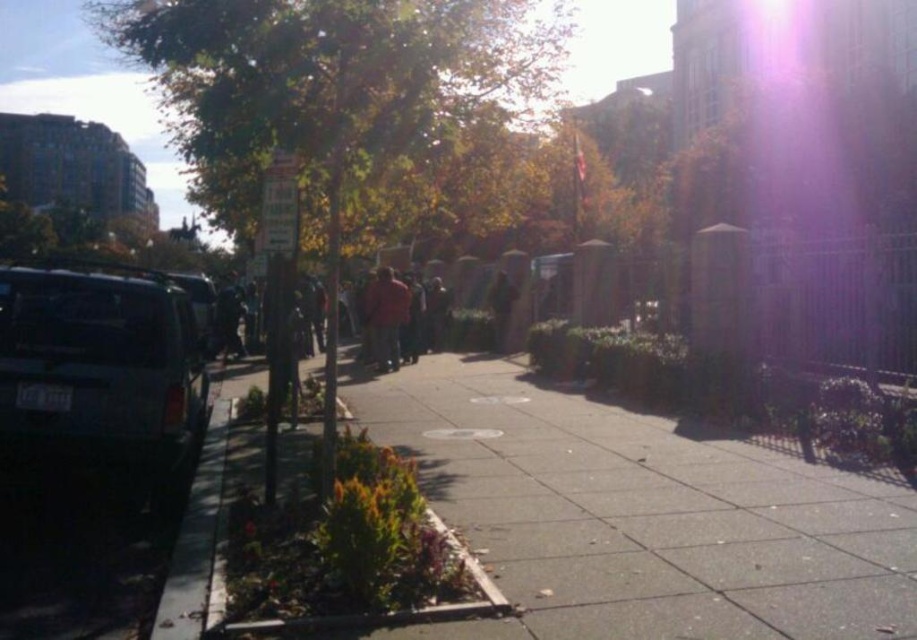
Which is behind, point (534, 12) or point (186, 285)?

Positioned behind is point (534, 12).

Find the location of a particular element. This screenshot has width=917, height=640. green leafy tree at left is located at coordinates (330, 93).

Can you confirm if black rubber curb at lower left is taller than matte black suv at left?

No, black rubber curb at lower left is not taller than matte black suv at left.

Describe the element at coordinates (195, 536) in the screenshot. I see `black rubber curb at lower left` at that location.

Identify the location of black rubber curb at lower left. (195, 536).

Is gray concrete sidewalk at center to the right of red matte jacket at center from the viewer's perspective?

Correct, you'll find gray concrete sidewalk at center to the right of red matte jacket at center.

Looking at this image, who is shorter, gray concrete sidewalk at center or red matte jacket at center?

With less height is gray concrete sidewalk at center.

The width and height of the screenshot is (917, 640). Identify the location of gray concrete sidewalk at center. (639, 516).